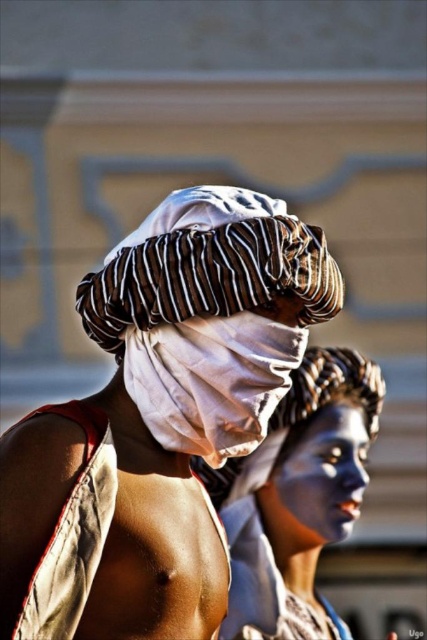
Can you confirm if white cloth at center is positioned above blue matte face paint at center?

Correct, white cloth at center is located above blue matte face paint at center.

Consider the image. Can you confirm if white cloth at center is wider than blue matte face paint at center?

Yes.

This screenshot has width=427, height=640. What do you see at coordinates (158, 420) in the screenshot?
I see `white cloth at center` at bounding box center [158, 420].

Find the location of `white cloth at center`. white cloth at center is located at coordinates (158, 420).

Which is behind, point (298, 296) or point (249, 497)?

Positioned behind is point (249, 497).

Is point (128, 241) closer to camera compared to point (259, 525)?

Yes, it is in front of point (259, 525).

Measure the distance between point (x=149, y=288) and camera.

Point (x=149, y=288) is 142.06 feet from camera.

Image resolution: width=427 pixels, height=640 pixels. Identify the location of white cotton headscarf at center. (210, 314).

Is blue matte face paint at center bigger than blue matte face at center?

Indeed, blue matte face paint at center has a larger size compared to blue matte face at center.

Does blue matte face paint at center have a lesser height compared to blue matte face at center?

Incorrect, blue matte face paint at center's height does not fall short of blue matte face at center's.

Is point (262, 552) closer to viewer compared to point (350, 531)?

Yes.

I want to click on blue matte face paint at center, so click(298, 497).